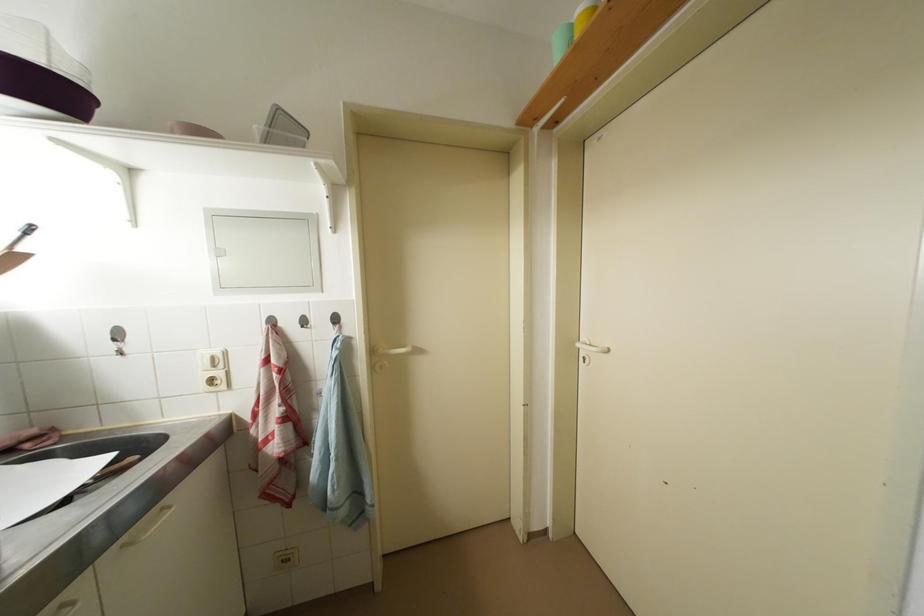
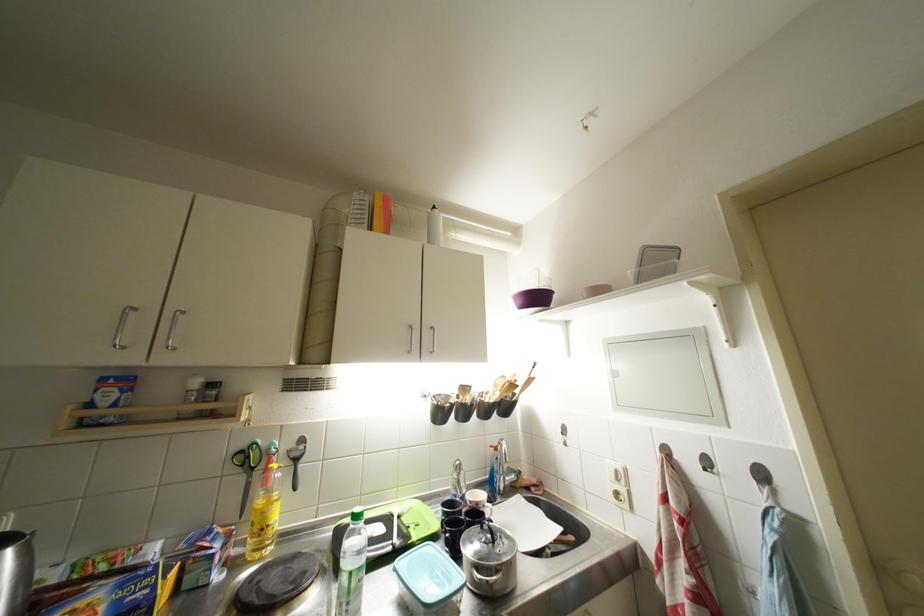
The point at (343,323) is marked in the first image. Where is the corresponding point in the second image?

(769, 479)